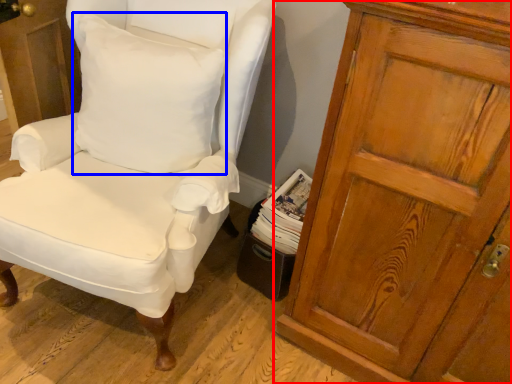
Question: Which of the following is the farthest to the observer, cupboard (highlighted by a red box) or pillow (highlighted by a blue box)?

Choices:
 (A) cupboard
 (B) pillow

Answer: (B)